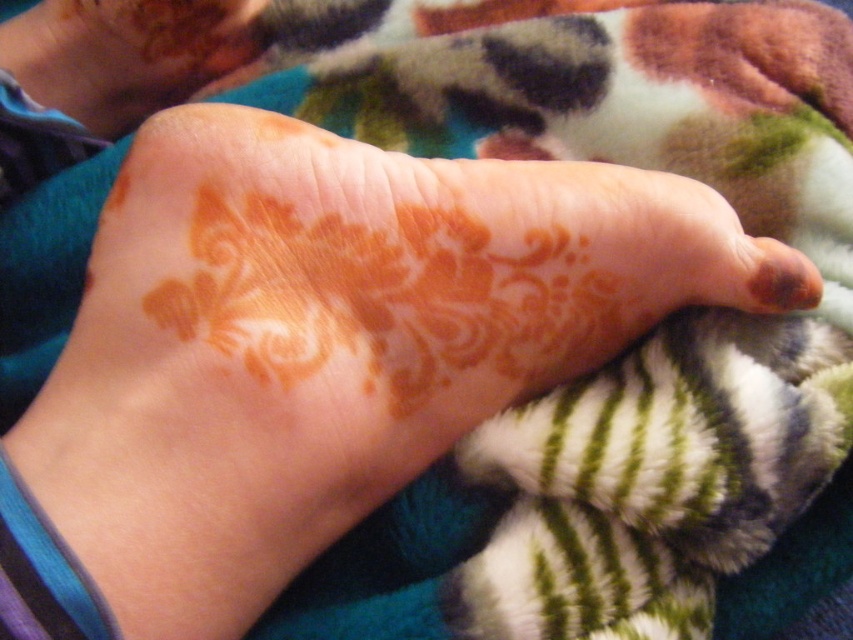
Question: Which point appears farthest from the camera in this image?

Choices:
 (A) (799, 266)
 (B) (172, 32)

Answer: (B)

Question: In this image, where is orange henna tattoo at center located relative to brown matte toe at center?

Choices:
 (A) below
 (B) above

Answer: (B)

Question: Observing the image, what is the correct spatial positioning of orange henna tattoo at center in reference to brown matte toe at center?

Choices:
 (A) below
 (B) above

Answer: (B)

Question: Which point is closer to the camera?

Choices:
 (A) (112, 112)
 (B) (770, 260)

Answer: (B)

Question: Is orange henna tattoo at center smaller than brown matte toe at center?

Choices:
 (A) yes
 (B) no

Answer: (B)

Question: Which of the following is the closest to the observer?

Choices:
 (A) brown matte toe at center
 (B) orange henna tattoo at center

Answer: (A)